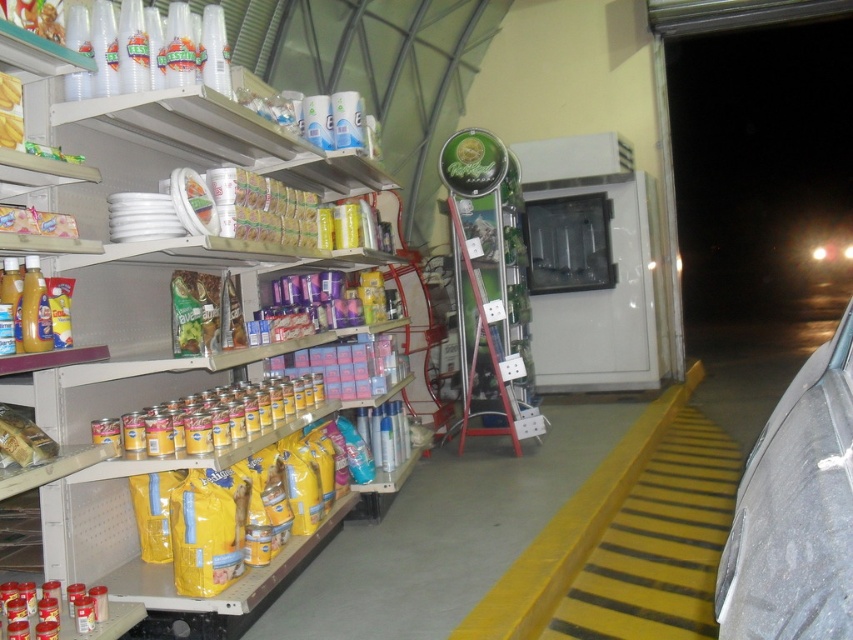
You are a delivery person who just entered the store and need to place a package on the shelf. The package is 0.4 meters wide. The store manager says you can only place it on the shelf where the yellow matte plastic bags at lower left are located. Can you fit the package on that shelf?

The yellow matte plastic bags at lower left are located at point (173, 250). Since the package is 0.4 meters wide, it can be placed there as the shelf has enough space.

You are standing in the convenience store and see the point marked at coordinate (173, 250). What item is located at that point?

The point at coordinate (173, 250) is located on the yellow matte plastic bags at lower left.

You are a customer entering the store and see the yellow rubber mat at lower right and the matte gold foil at shelf left. Which object is closer to you as you enter?

The yellow rubber mat at lower right is closer to you because the matte gold foil at shelf left is behind it.